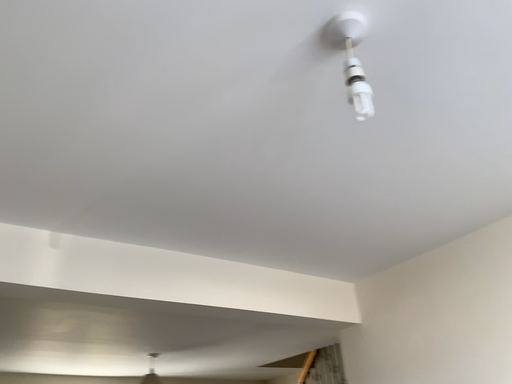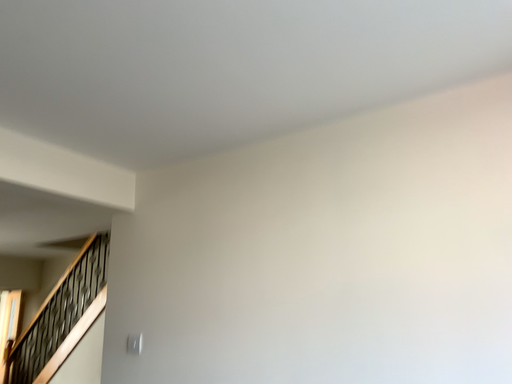
Question: Which way did the camera rotate in the video?

Choices:
 (A) rotated right
 (B) rotated left

Answer: (A)